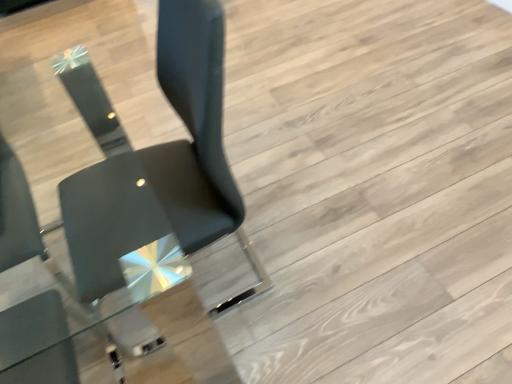
Find the location of `matte black chair at center, the second chair in the left-to-right sequence`. matte black chair at center, the second chair in the left-to-right sequence is located at coordinates (167, 165).

Measure the distance between point (221, 205) and camera.

1.17 meters.

The height and width of the screenshot is (384, 512). What do you see at coordinates (167, 165) in the screenshot?
I see `matte black chair at center, the 1th chair when ordered from right to left` at bounding box center [167, 165].

Measure the distance between matte black chair at lower left, arranged as the second chair when viewed from the right, and camera.

The distance of matte black chair at lower left, arranged as the second chair when viewed from the right, from camera is 36.06 inches.

How much space does matte black chair at lower left, which is the 1th chair in left-to-right order, occupy vertically?

matte black chair at lower left, which is the 1th chair in left-to-right order, is 70.91 centimeters in height.

How much space does matte black chair at lower left, which is the 1th chair in left-to-right order, occupy horizontally?

22.19 inches.

What are the coordinates of `matte black chair at lower left, which is the 1th chair in left-to-right order` in the screenshot? It's located at (37, 342).

This screenshot has width=512, height=384. What do you see at coordinates (37, 342) in the screenshot? I see `matte black chair at lower left, arranged as the second chair when viewed from the right` at bounding box center [37, 342].

The width and height of the screenshot is (512, 384). In order to click on matte black chair at center, the second chair in the left-to-right sequence in this screenshot , I will do `click(167, 165)`.

Can you confirm if matte black chair at lower left, which is the 1th chair in left-to-right order, is positioned to the left of matte black chair at center, the second chair in the left-to-right sequence?

Yes.

Which is in front, matte black chair at lower left, which is the 1th chair in left-to-right order, or matte black chair at center, the 1th chair when ordered from right to left?

matte black chair at center, the 1th chair when ordered from right to left, is in front.

Which is behind, point (4, 239) or point (252, 285)?

The point (252, 285) is more distant.

From the picture: From the image's perspective, does matte black chair at lower left, which is the 1th chair in left-to-right order, appear higher than matte black chair at center, the second chair in the left-to-right sequence?

No.

From a real-world perspective, which object stands above the other?

matte black chair at center, the second chair in the left-to-right sequence.

Is matte black chair at lower left, arranged as the second chair when viewed from the right, thinner than matte black chair at center, the 1th chair when ordered from right to left?

Correct, the width of matte black chair at lower left, arranged as the second chair when viewed from the right, is less than that of matte black chair at center, the 1th chair when ordered from right to left.

Which of these two, matte black chair at lower left, which is the 1th chair in left-to-right order, or matte black chair at center, the second chair in the left-to-right sequence, stands shorter?

With less height is matte black chair at lower left, which is the 1th chair in left-to-right order.

Between matte black chair at lower left, which is the 1th chair in left-to-right order, and matte black chair at center, the second chair in the left-to-right sequence, which one has smaller size?

With smaller size is matte black chair at lower left, which is the 1th chair in left-to-right order.

Is matte black chair at lower left, which is the 1th chair in left-to-right order, inside the boundaries of matte black chair at center, the 1th chair when ordered from right to left, or outside?

matte black chair at lower left, which is the 1th chair in left-to-right order, is not inside matte black chair at center, the 1th chair when ordered from right to left, it's outside.

Are matte black chair at lower left, which is the 1th chair in left-to-right order, and matte black chair at center, the second chair in the left-to-right sequence, located far from each other?

No, matte black chair at lower left, which is the 1th chair in left-to-right order, is not far from matte black chair at center, the second chair in the left-to-right sequence.

Is matte black chair at center, the second chair in the left-to-right sequence, at the back of matte black chair at lower left, arranged as the second chair when viewed from the right?

No, matte black chair at center, the second chair in the left-to-right sequence, is not at the back of matte black chair at lower left, arranged as the second chair when viewed from the right.

What's the angular difference between matte black chair at lower left, arranged as the second chair when viewed from the right, and matte black chair at center, the 1th chair when ordered from right to left,'s facing directions?

There is a 90.9-degree angle between the facing directions of matte black chair at lower left, arranged as the second chair when viewed from the right, and matte black chair at center, the 1th chair when ordered from right to left.

Measure the distance between matte black chair at lower left, arranged as the second chair when viewed from the right, and matte black chair at center, the second chair in the left-to-right sequence.

They are 11.02 inches apart.

You are a GUI agent. You are given a task and a screenshot of the screen. Output one action in this format:
    pyautogui.click(x=<x>, y=<y>)
    Task: Click on the chair that is behind the matte black chair at center, the second chair in the left-to-right sequence
    The width and height of the screenshot is (512, 384).
    Given the screenshot: What is the action you would take?
    pyautogui.click(x=37, y=342)

Is matte black chair at center, the 1th chair when ordered from right to left, to the right of matte black chair at lower left, which is the 1th chair in left-to-right order, from the viewer's perspective?

Indeed, matte black chair at center, the 1th chair when ordered from right to left, is positioned on the right side of matte black chair at lower left, which is the 1th chair in left-to-right order.

Is matte black chair at center, the second chair in the left-to-right sequence, in front of matte black chair at lower left, arranged as the second chair when viewed from the right?

Yes, it is in front of matte black chair at lower left, arranged as the second chair when viewed from the right.

Is point (194, 17) closer or farther from the camera than point (10, 309)?

Point (194, 17).

From the image's perspective, between matte black chair at center, the second chair in the left-to-right sequence, and matte black chair at lower left, arranged as the second chair when viewed from the right, which one is located above?

matte black chair at center, the second chair in the left-to-right sequence.

In the scene shown: From a real-world perspective, who is located lower, matte black chair at center, the second chair in the left-to-right sequence, or matte black chair at lower left, arranged as the second chair when viewed from the right?

In real-world perspective, matte black chair at lower left, arranged as the second chair when viewed from the right, is lower.

Is matte black chair at center, the second chair in the left-to-right sequence, thinner than matte black chair at lower left, arranged as the second chair when viewed from the right?

In fact, matte black chair at center, the second chair in the left-to-right sequence, might be wider than matte black chair at lower left, arranged as the second chair when viewed from the right.

Which of these two, matte black chair at center, the second chair in the left-to-right sequence, or matte black chair at lower left, which is the 1th chair in left-to-right order, stands shorter?

Standing shorter between the two is matte black chair at lower left, which is the 1th chair in left-to-right order.

Can you confirm if matte black chair at center, the second chair in the left-to-right sequence, is smaller than matte black chair at lower left, which is the 1th chair in left-to-right order?

No, matte black chair at center, the second chair in the left-to-right sequence, is not smaller than matte black chair at lower left, which is the 1th chair in left-to-right order.

Can we say matte black chair at center, the second chair in the left-to-right sequence, lies outside matte black chair at lower left, which is the 1th chair in left-to-right order?

Yes, matte black chair at center, the second chair in the left-to-right sequence, is not within matte black chair at lower left, which is the 1th chair in left-to-right order.

Is matte black chair at center, the 1th chair when ordered from right to left, in contact with matte black chair at lower left, arranged as the second chair when viewed from the right?

No, matte black chair at center, the 1th chair when ordered from right to left, is not beside matte black chair at lower left, arranged as the second chair when viewed from the right.

Is matte black chair at center, the second chair in the left-to-right sequence, turned away from matte black chair at lower left, which is the 1th chair in left-to-right order?

matte black chair at center, the second chair in the left-to-right sequence, does not have its back to matte black chair at lower left, which is the 1th chair in left-to-right order.

What's the angular difference between matte black chair at center, the 1th chair when ordered from right to left, and matte black chair at lower left, which is the 1th chair in left-to-right order,'s facing directions?

There is a 90.9-degree angle between the facing directions of matte black chair at center, the 1th chair when ordered from right to left, and matte black chair at lower left, which is the 1th chair in left-to-right order.

At what (x,y) coordinates should I click in order to perform the action: click on chair above the matte black chair at lower left, arranged as the second chair when viewed from the right (from the image's perspective). Please return your answer as a coordinate pair (x, y). Looking at the image, I should click on (167, 165).

Image resolution: width=512 pixels, height=384 pixels. Identify the location of chair below the matte black chair at center, the 1th chair when ordered from right to left (from a real-world perspective). (37, 342).

Image resolution: width=512 pixels, height=384 pixels. In order to click on chair below the matte black chair at center, the 1th chair when ordered from right to left (from the image's perspective) in this screenshot , I will do `click(37, 342)`.